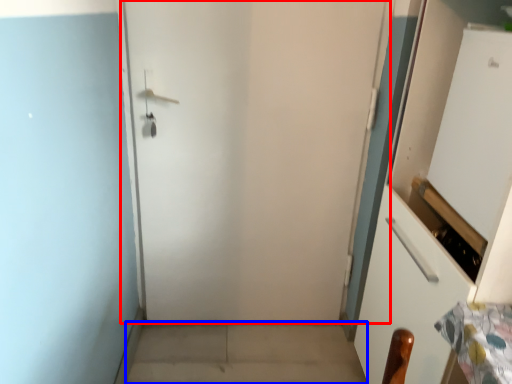
Question: Which object appears farthest to the camera in this image, door (highlighted by a red box) or concrete (highlighted by a blue box)?

Choices:
 (A) door
 (B) concrete

Answer: (B)